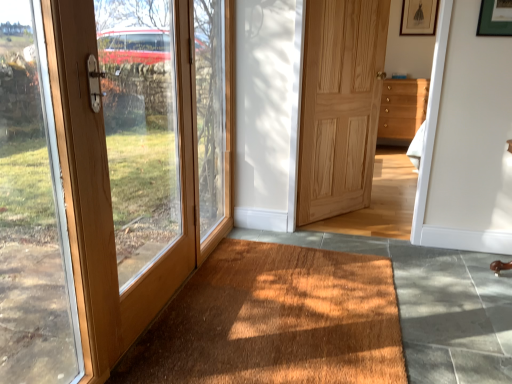
Question: Are matte wood door at left, the second door in the right-to-left sequence, and wooden chest of drawers at center-right far apart?

Choices:
 (A) no
 (B) yes

Answer: (B)

Question: Can you confirm if matte wood door at left, which ranks as the 1th door in left-to-right order, is thinner than wooden chest of drawers at center-right?

Choices:
 (A) no
 (B) yes

Answer: (B)

Question: From a real-world perspective, is matte wood door at left, placed as the 1th door when sorted from front to back, below wooden chest of drawers at center-right?

Choices:
 (A) yes
 (B) no

Answer: (B)

Question: Is matte wood door at left, which ranks as the 1th door in left-to-right order, beside wooden chest of drawers at center-right?

Choices:
 (A) yes
 (B) no

Answer: (B)

Question: Is wooden chest of drawers at center-right completely or partially inside matte wood door at left, the second door in the right-to-left sequence?

Choices:
 (A) no
 (B) yes

Answer: (A)

Question: Considering the positions of natural wood door at center, the 2th door positioned from the left, and matte black picture frame at upper right in the image, is natural wood door at center, the 2th door positioned from the left, bigger or smaller than matte black picture frame at upper right?

Choices:
 (A) small
 (B) big

Answer: (B)

Question: From a real-world perspective, is natural wood door at center, which is counted as the first door, starting from the right, above or below matte black picture frame at upper right?

Choices:
 (A) above
 (B) below

Answer: (B)

Question: In the image, is natural wood door at center, marked as the first door in a back-to-front arrangement, on the left side or the right side of matte black picture frame at upper right?

Choices:
 (A) left
 (B) right

Answer: (A)

Question: Considering the positions of natural wood door at center, the 2th door positioned from the left, and matte black picture frame at upper right in the image, is natural wood door at center, the 2th door positioned from the left, wider or thinner than matte black picture frame at upper right?

Choices:
 (A) thin
 (B) wide

Answer: (B)

Question: In terms of width, does matte wood door at left, the second door in the right-to-left sequence, look wider or thinner when compared to brown textured mat at lower center?

Choices:
 (A) wide
 (B) thin

Answer: (B)

Question: Is matte wood door at left, the second door in the right-to-left sequence, to the left or to the right of brown textured mat at lower center in the image?

Choices:
 (A) left
 (B) right

Answer: (A)

Question: In the image, is matte wood door at left, the second door in the right-to-left sequence, positioned in front of or behind brown textured mat at lower center?

Choices:
 (A) behind
 (B) front

Answer: (B)

Question: From a real-world perspective, is matte wood door at left, which ranks as the 1th door in left-to-right order, physically located above or below brown textured mat at lower center?

Choices:
 (A) below
 (B) above

Answer: (B)

Question: Is matte black picture frame at upper right taller or shorter than wooden chest of drawers at center-right?

Choices:
 (A) tall
 (B) short

Answer: (B)

Question: From the image's perspective, is matte black picture frame at upper right above or below wooden chest of drawers at center-right?

Choices:
 (A) below
 (B) above

Answer: (B)